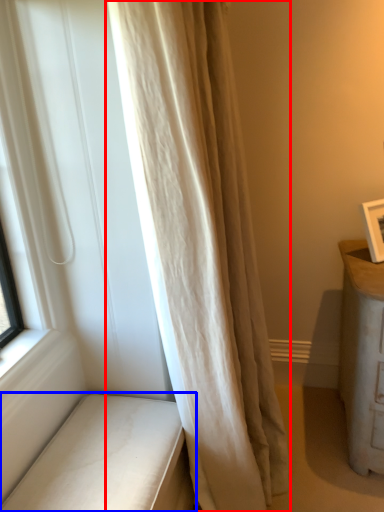
Question: Among these objects, which one is nearest to the camera, curtain (highlighted by a red box) or furniture (highlighted by a blue box)?

Choices:
 (A) curtain
 (B) furniture

Answer: (A)